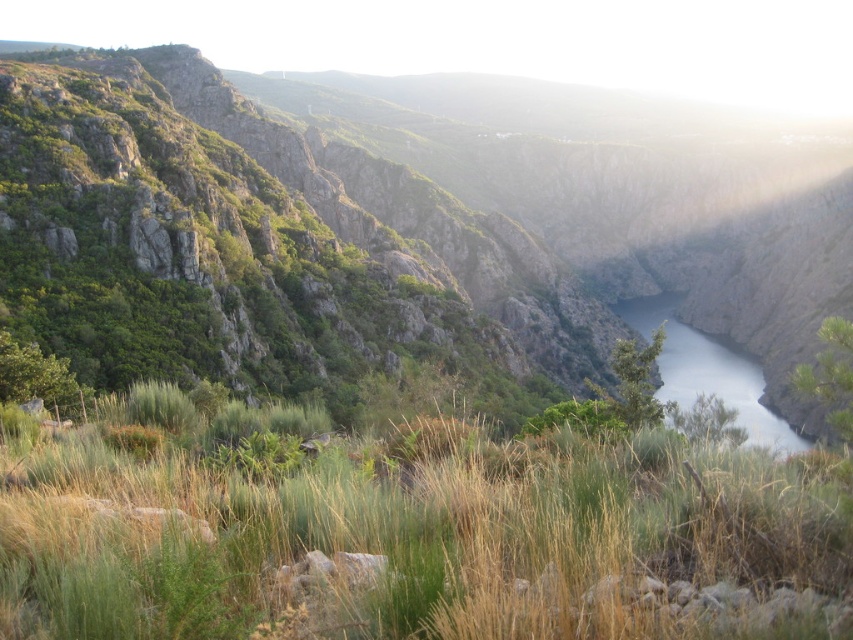
You are a hiker who wants to cross the canyon. You notice green grassy at center and clear water at center. Which one is shorter in height?

The green grassy at center is not as tall as the clear water at center, so the green grassy at center is shorter in height.

Based on the photo, you are standing at the point marked by the coordinates point (x=378, y=234) in the canyon. Looking around, you notice the green rock at center. Which direction should you face to see the green rock at center?

You are already at the green rock at center, so you can face any direction to see it since you are standing on it.